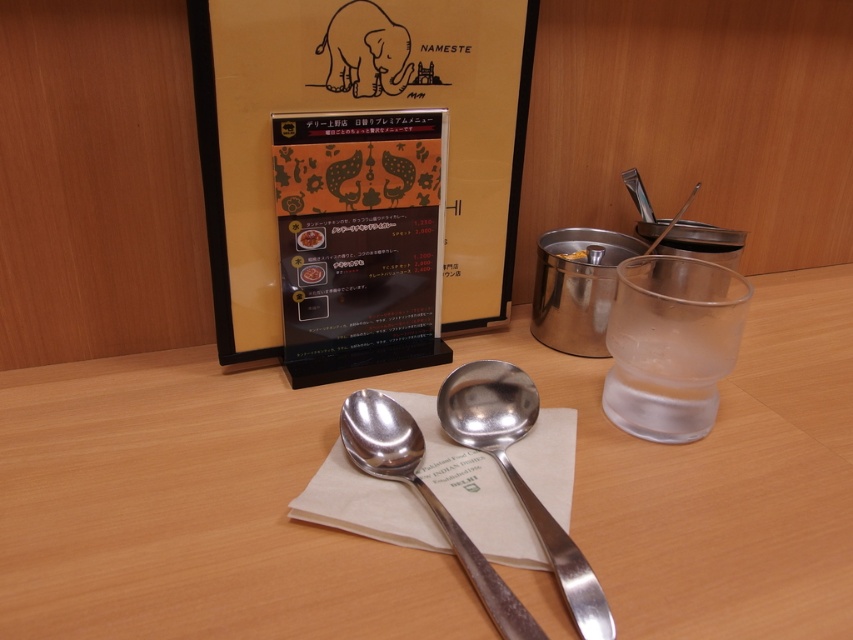
Question: Which object appears farthest from the camera in this image?

Choices:
 (A) polished silver spoon at center
 (B) black plastic menu at center
 (C) matte brown elephant at upper center
 (D) matte orange menu at upper center

Answer: (B)

Question: Does polished silver spoon at center appear under matte brown elephant at upper center?

Choices:
 (A) no
 (B) yes

Answer: (B)

Question: Which of the following is the farthest from the observer?

Choices:
 (A) silver metallic spoon at center
 (B) black plastic menu at center

Answer: (B)

Question: Can you confirm if black plastic menu at center is wider than polished silver spoon at center?

Choices:
 (A) no
 (B) yes

Answer: (B)

Question: Does matte orange menu at upper center have a larger size compared to silver metallic spoon at center?

Choices:
 (A) yes
 (B) no

Answer: (A)

Question: Among these points, which one is farthest from the camera?

Choices:
 (A) (125, 397)
 (B) (471, 186)

Answer: (B)